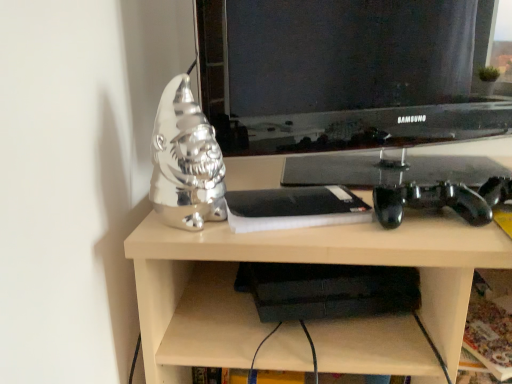
Question: From the image's perspective, is shiny silver gnome at left above or below metallic silver gnome at left?

Choices:
 (A) below
 (B) above

Answer: (B)

Question: Is shiny silver gnome at left in front of or behind metallic silver gnome at left in the image?

Choices:
 (A) behind
 (B) front

Answer: (A)

Question: Estimate the real-world distances between objects in this image. Which object is closer to the shiny silver gnome at left?

Choices:
 (A) metallic silver gnome at left
 (B) matte black television at center

Answer: (A)

Question: Estimate the real-world distances between objects in this image. Which object is farther from the matte black television at center?

Choices:
 (A) metallic silver gnome at left
 (B) shiny silver gnome at left

Answer: (B)